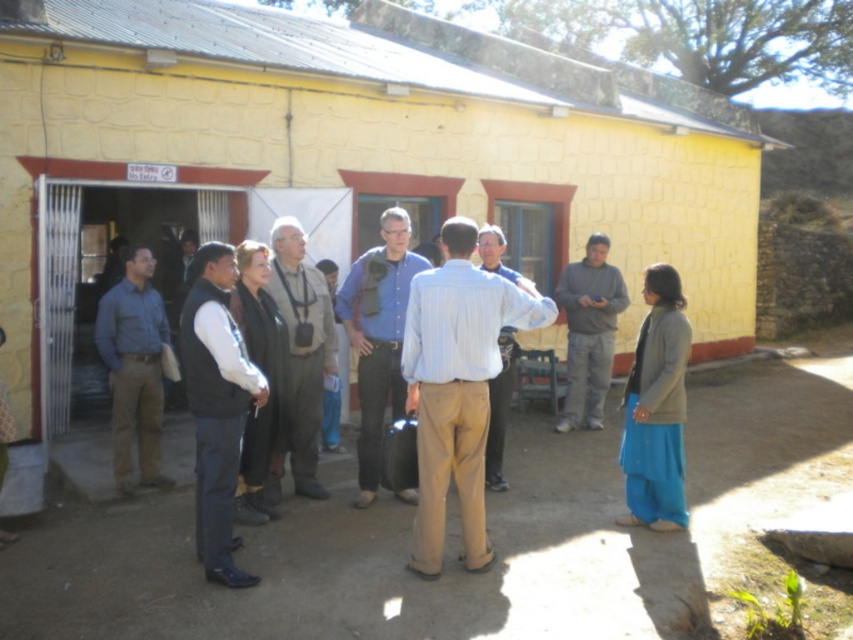
Question: Which of the following is the farthest from the observer?

Choices:
 (A) (628, 396)
 (B) (196, 371)

Answer: (A)

Question: Does blue shirt at left have a lesser width compared to gray fabric vest at center?

Choices:
 (A) no
 (B) yes

Answer: (A)

Question: Is blue shirt at center wider than white shirt at center?

Choices:
 (A) yes
 (B) no

Answer: (A)

Question: Which of the following is the farthest from the observer?

Choices:
 (A) (627, 390)
 (B) (383, 360)
 (C) (503, 404)

Answer: (C)

Question: Which object is closer to the camera taking this photo?

Choices:
 (A) gray fabric vest at center
 (B) blue cotton dress at lower right
 (C) blue shirt at left

Answer: (B)

Question: Is blue shirt at left thinner than gray fabric vest at center?

Choices:
 (A) yes
 (B) no

Answer: (B)